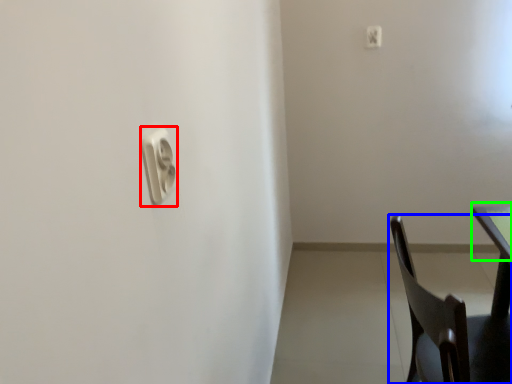
Question: Which object is positioned farthest from light switch (highlighted by a red box)? Select from chair (highlighted by a blue box) and table top (highlighted by a green box).

Choices:
 (A) chair
 (B) table top

Answer: (B)